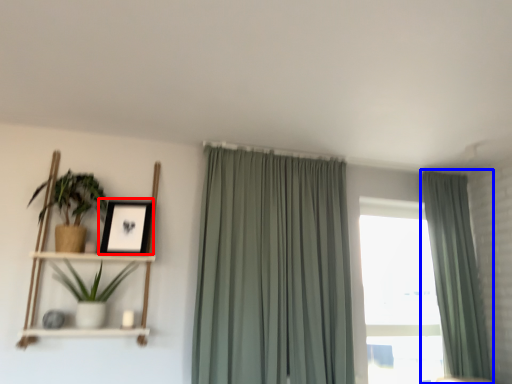
Question: Which object appears closest to the camera in this image, picture frame (highlighted by a red box) or curtain (highlighted by a blue box)?

Choices:
 (A) picture frame
 (B) curtain

Answer: (A)